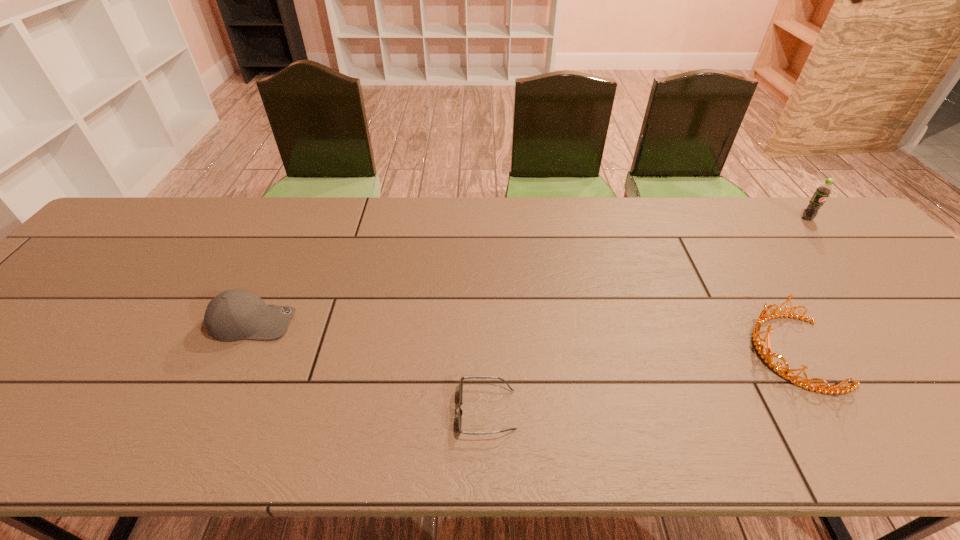
Where is `vacant space that's between the baseball cap and the shortest object`? vacant space that's between the baseball cap and the shortest object is located at coordinates (371, 367).

Find the location of a particular element. The image size is (960, 540). free space between the rightmost object and the second object from right to left is located at coordinates (800, 285).

At what (x,y) coordinates should I click in order to perform the action: click on free space between the shortest object and the baseball cap. Please return your answer as a coordinate pair (x, y). Looking at the image, I should click on (371, 367).

Find the location of a particular element. Image resolution: width=960 pixels, height=540 pixels. object that is the third nearest to the tiara is located at coordinates (232, 315).

Locate which object is the closest to the tiara. Please provide its 2D coordinates. Your answer should be formatted as a tuple, i.e. [(x, y)], where the tuple contains the x and y coordinates of a point satisfying the conditions above.

[(822, 192)]

In order to click on vacant space that satisfies the following two spatial constraints: 1. on the front label of the farthest object; 2. on the front brim of the baseball cap in this screenshot , I will do `click(899, 322)`.

In order to click on free region that satisfies the following two spatial constraints: 1. on the front label of the farthest object; 2. on the front-facing side of the third object from left to right in this screenshot , I will do `click(925, 352)`.

Find the location of a particular element. The height and width of the screenshot is (540, 960). free space that satisfies the following two spatial constraints: 1. on the front label of the tallest object; 2. on the front-facing side of the third object from left to right is located at coordinates (925, 352).